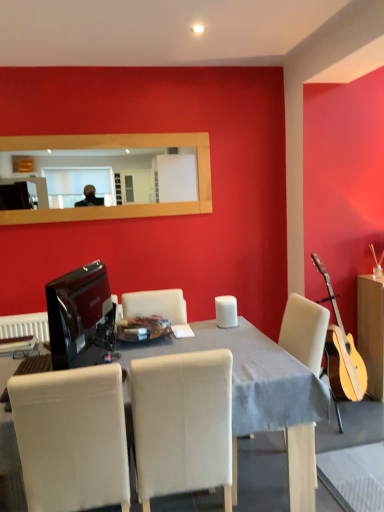
Question: Is white fabric chair at lower left, the second chair viewed from the right, positioned with its back to wooden cabinet at right?

Choices:
 (A) no
 (B) yes

Answer: (A)

Question: From a real-world perspective, is white fabric chair at lower left, which is the 1th chair in left-to-right order, located beneath wooden cabinet at right?

Choices:
 (A) no
 (B) yes

Answer: (A)

Question: Considering the relative sizes of white fabric chair at lower left, which is the 1th chair in left-to-right order, and wooden cabinet at right in the image provided, is white fabric chair at lower left, which is the 1th chair in left-to-right order, bigger than wooden cabinet at right?

Choices:
 (A) yes
 (B) no

Answer: (A)

Question: Does white fabric chair at lower left, which is the 1th chair in left-to-right order, have a lesser width compared to wooden cabinet at right?

Choices:
 (A) yes
 (B) no

Answer: (B)

Question: Considering the relative sizes of white fabric chair at lower left, which is the 1th chair in left-to-right order, and wooden cabinet at right in the image provided, is white fabric chair at lower left, which is the 1th chair in left-to-right order, shorter than wooden cabinet at right?

Choices:
 (A) yes
 (B) no

Answer: (B)

Question: Is beige fabric chair at center, acting as the 2th chair starting from the left, taller or shorter than wooden cabinet at right?

Choices:
 (A) tall
 (B) short

Answer: (A)

Question: Does point (144, 463) appear closer or farther from the camera than point (374, 305)?

Choices:
 (A) farther
 (B) closer

Answer: (B)

Question: From a real-world perspective, relative to wooden cabinet at right, is beige fabric chair at center, which is the first chair in right-to-left order, vertically above or below?

Choices:
 (A) above
 (B) below

Answer: (A)

Question: Looking at their shapes, would you say beige fabric chair at center, acting as the 2th chair starting from the left, is wider or thinner than wooden cabinet at right?

Choices:
 (A) wide
 (B) thin

Answer: (A)

Question: From the image's perspective, is clear glass plate at center above or below white fabric chair at lower left, which is the 1th chair in left-to-right order?

Choices:
 (A) below
 (B) above

Answer: (B)

Question: Is clear glass plate at center situated inside white fabric chair at lower left, which is the 1th chair in left-to-right order, or outside?

Choices:
 (A) outside
 (B) inside

Answer: (A)

Question: From their relative heights in the image, would you say clear glass plate at center is taller or shorter than white fabric chair at lower left, the second chair viewed from the right?

Choices:
 (A) short
 (B) tall

Answer: (A)

Question: Considering the positions of point (152, 325) and point (21, 461), is point (152, 325) closer or farther from the camera than point (21, 461)?

Choices:
 (A) closer
 (B) farther

Answer: (B)

Question: Considering the positions of point (218, 295) and point (177, 436), is point (218, 295) closer or farther from the camera than point (177, 436)?

Choices:
 (A) farther
 (B) closer

Answer: (A)

Question: Would you say white matte speaker at center is to the left or to the right of beige fabric chair at center, acting as the 2th chair starting from the left, in the picture?

Choices:
 (A) left
 (B) right

Answer: (B)